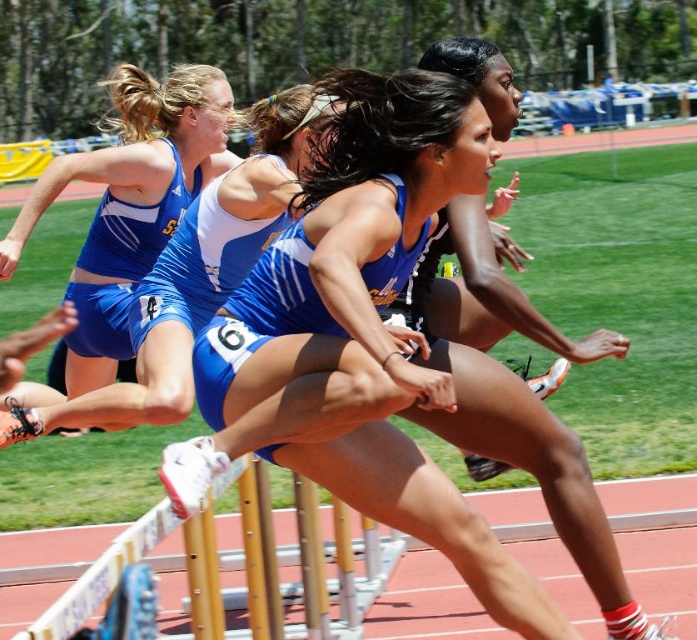
You are a track official measuring the height of the blue fabric shorts at center and the wooden hurdle at center. Which one is taller?

The blue fabric shorts at center is taller than the wooden hurdle at center.

You are a photographer positioned at the finish line of the hurdle race. You want to capture a photo of the blue fabric shorts at center and the matte blue shorts at left. Which athlete should you focus on first to ensure both are in the frame?

The blue fabric shorts at center is in front of the matte blue shorts at left, so you should focus on the blue fabric shorts at center first to ensure both are in the frame.

What is the exact coordinate of the blue fabric shorts at center?

The blue fabric shorts at center is located at point (359, 336).